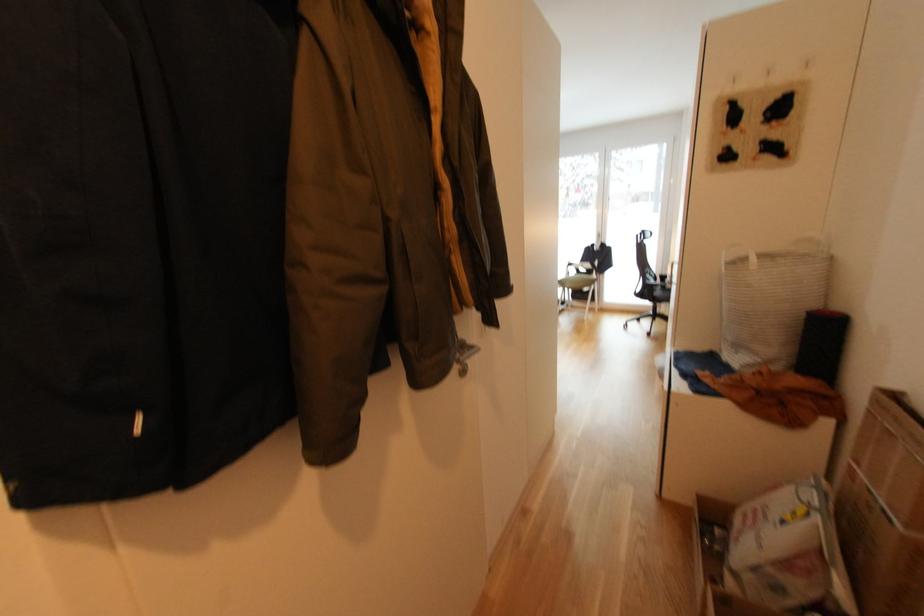
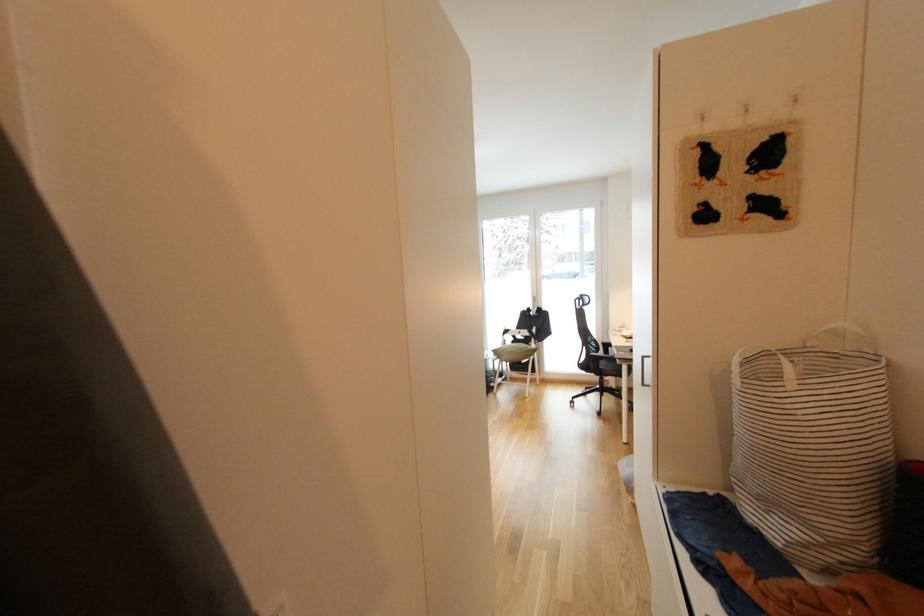
The images are taken continuously from a first-person perspective. In which direction are you moving?

The cameraman moved toward right, forward.